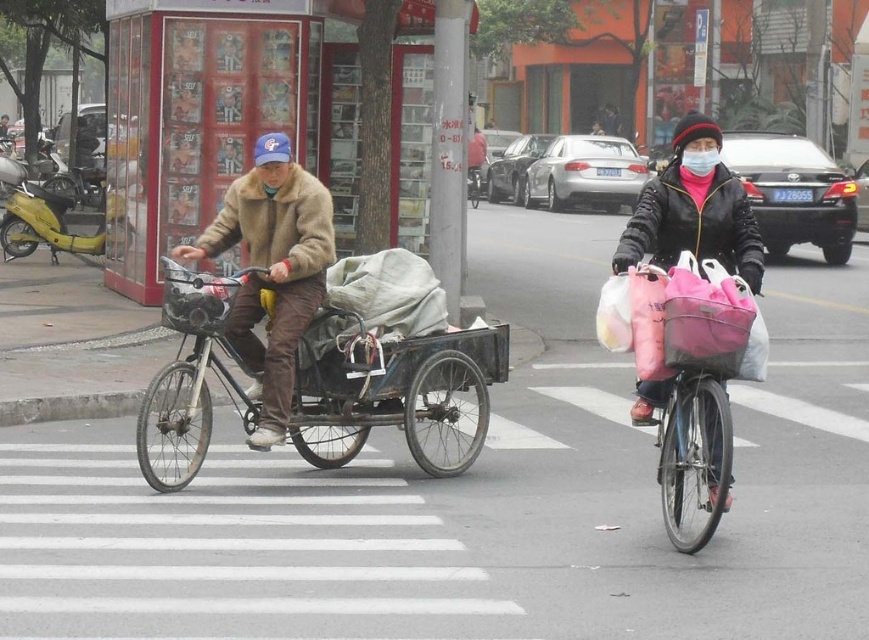
You are a delivery person who needs to deliver a package to a client. You see a black leather jacket at center and a pink fabric bag at center in the image. Can you tell me which one is closer to you?

The distance between the black leather jacket at center and the pink fabric bag at center is 23.58 centimeters, so they are both at the same distance from you since they are both at the center.